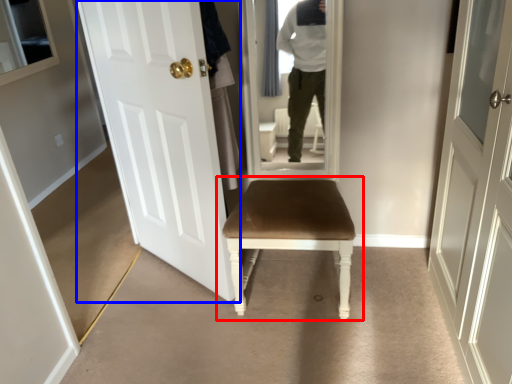
Question: Which point is closer to the camera, chair (highlighted by a red box) or door (highlighted by a blue box)?

Choices:
 (A) chair
 (B) door

Answer: (B)